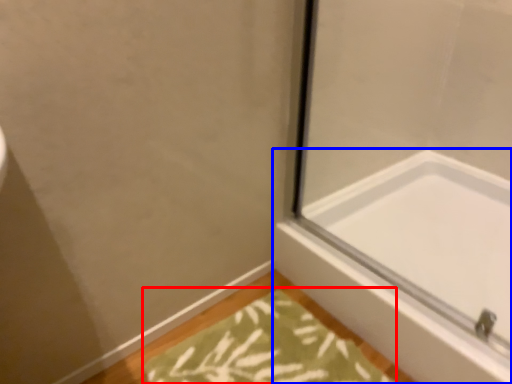
Question: Which object is closer to the camera taking this photo, bath mat (highlighted by a red box) or bathtub (highlighted by a blue box)?

Choices:
 (A) bath mat
 (B) bathtub

Answer: (A)